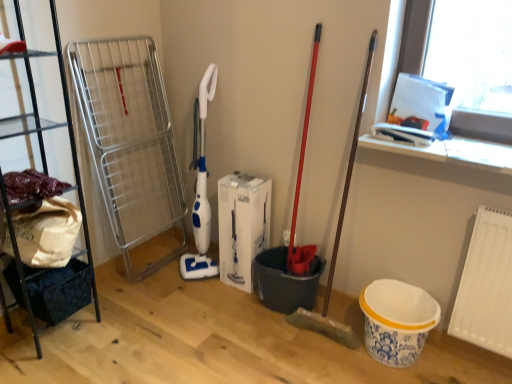
Question: Visually, is white matte radiator at lower right positioned to the left or to the right of dark blue fabric basket at lower left?

Choices:
 (A) right
 (B) left

Answer: (A)

Question: Based on their sizes in the image, would you say white matte radiator at lower right is bigger or smaller than dark blue fabric basket at lower left?

Choices:
 (A) small
 (B) big

Answer: (A)

Question: Which object is positioned farthest from the black metal shelf at left?

Choices:
 (A) dark blue fabric basket at lower left
 (B) white matte radiator at lower right

Answer: (B)

Question: Estimate the real-world distances between objects in this image. Which object is farther from the white matte radiator at lower right?

Choices:
 (A) black metal shelf at left
 (B) dark blue fabric basket at lower left

Answer: (A)